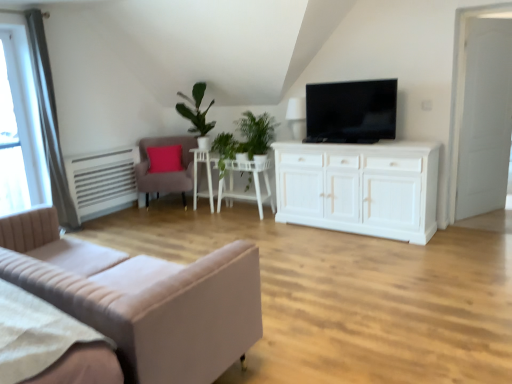
Question: Would you say green leafy plant at center is to the left or to the right of beige fabric studio couch at lower left in the picture?

Choices:
 (A) left
 (B) right

Answer: (B)

Question: Is green leafy plant at center inside the boundaries of beige fabric studio couch at lower left, or outside?

Choices:
 (A) inside
 (B) outside

Answer: (B)

Question: Which of these objects is positioned farthest from the black glossy tv at upper center?

Choices:
 (A) white wooden table at center
 (B) green leafy plant at center
 (C) white wooden door at right
 (D) white glossy lamp at upper center
 (E) transparent glass window at upper left

Answer: (E)

Question: Which object is the farthest from the white glossy side table at center?

Choices:
 (A) green leafy plant at center
 (B) white wooden table at center
 (C) white glossy lamp at upper center
 (D) beige fabric studio couch at lower left
 (E) transparent glass window at upper left

Answer: (D)